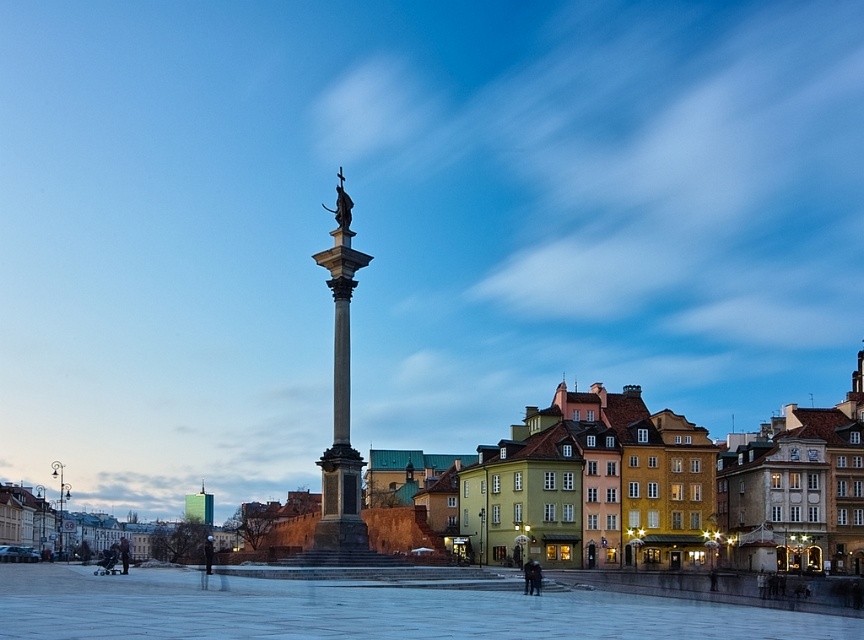
You are a tourist standing in front of the monument and want to take a photo that includes both the polished stone column at center and the polished bronze statue at center. To ensure both are visible in the frame, which direction should you position yourself relative to the monument?

You should position yourself to the left of the monument so that both the polished stone column at center and the polished bronze statue at center are visible in the frame. Since the polished stone column at center is to the right of the polished bronze statue at center, positioning yourself to the left will allow you to capture both objects in your photo.

You are a tourist standing in front of the monument and want to take a photo of the polished stone column at center and the polished bronze statue at center. Which object will appear larger in your photo?

The polished stone column at center will appear larger in the photo because it is closer to the viewer than the polished bronze statue at center.

You are standing in front of the monument and looking at the two points marked in the image. Which point, point (341, 440) or point (340, 221), is closer to you?

Point (341, 440) is closer to the viewer than point (340, 221).